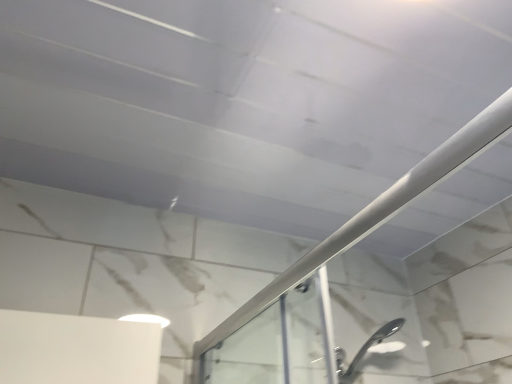
What do you see at coordinates (378, 211) in the screenshot? Image resolution: width=512 pixels, height=384 pixels. I see `satin silver shower at upper center` at bounding box center [378, 211].

Find the location of a particular element. This screenshot has width=512, height=384. satin silver shower at upper center is located at coordinates (378, 211).

This screenshot has height=384, width=512. What are the coordinates of `satin silver shower at upper center` in the screenshot? It's located at (378, 211).